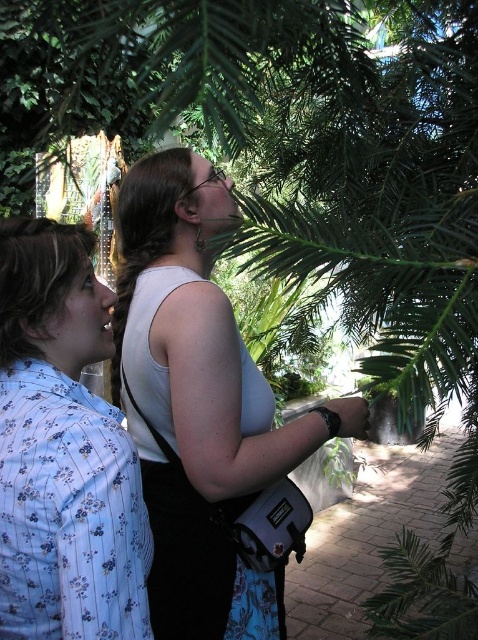
Question: Is white matte tank top at center further to camera compared to blue floral shirt at left?

Choices:
 (A) yes
 (B) no

Answer: (A)

Question: Is the position of white matte tank top at center more distant than that of blue floral shirt at left?

Choices:
 (A) yes
 (B) no

Answer: (A)

Question: Considering the relative positions of white matte tank top at center and blue floral shirt at left in the image provided, where is white matte tank top at center located with respect to blue floral shirt at left?

Choices:
 (A) below
 (B) above

Answer: (A)

Question: Which point is farther from the camera taking this photo?

Choices:
 (A) (241, 602)
 (B) (82, 500)

Answer: (A)